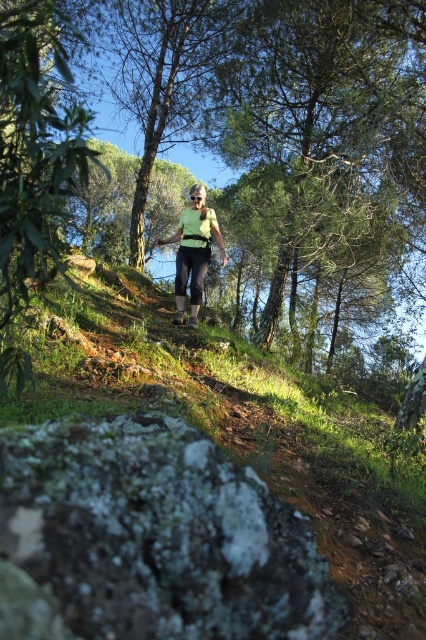
Question: Considering the real-world distances, which object is farthest from the green mossy rock at lower left?

Choices:
 (A) green matte vest at center
 (B) green leafy tree at upper center

Answer: (B)

Question: Is green leafy tree at upper center below green mossy rock at lower left?

Choices:
 (A) yes
 (B) no

Answer: (B)

Question: Which object appears farthest from the camera in this image?

Choices:
 (A) green leafy tree at upper center
 (B) green mossy rock at lower left

Answer: (A)

Question: Among these points, which one is nearest to the camera?

Choices:
 (A) (258, 538)
 (B) (359, 19)

Answer: (A)

Question: Does green mossy rock at lower left have a smaller size compared to green matte vest at center?

Choices:
 (A) no
 (B) yes

Answer: (A)

Question: Is green leafy tree at upper center thinner than green mossy rock at lower left?

Choices:
 (A) yes
 (B) no

Answer: (B)